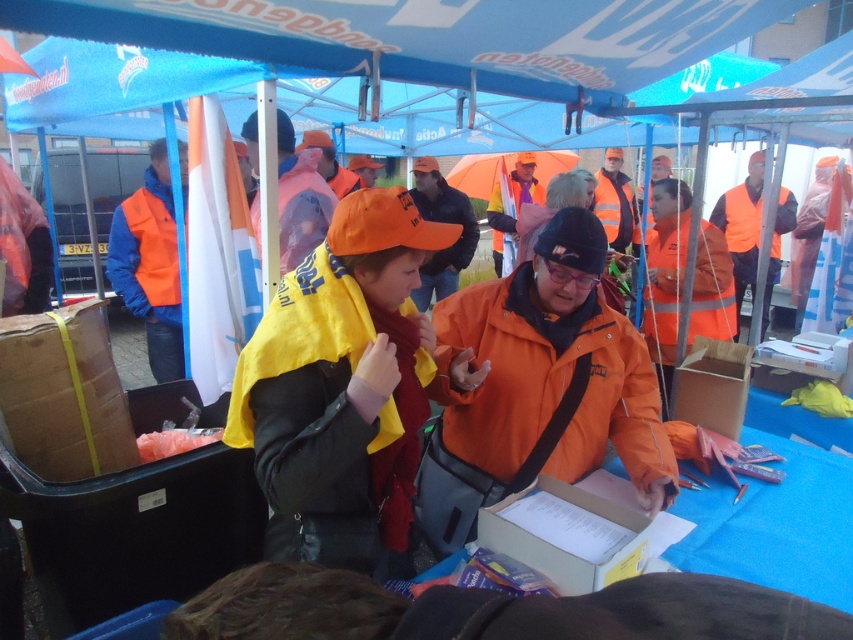
Can you confirm if orange reflective jacket at center is positioned below orange fabric cap at center?

Correct, orange reflective jacket at center is located below orange fabric cap at center.

How much distance is there between orange reflective jacket at center and orange fabric cap at center?

orange reflective jacket at center is 7.15 feet from orange fabric cap at center.

Does point (306, 211) lie in front of point (471, 220)?

Yes, it is in front of point (471, 220).

Identify the location of orange reflective jacket at center. The image size is (853, 640). (299, 198).

Who is shorter, orange matte jacket at center or cardboard box at center?

Standing shorter between the two is cardboard box at center.

Is orange matte jacket at center above cardboard box at center?

Yes, orange matte jacket at center is above cardboard box at center.

Is point (642, 342) farther from camera compared to point (550, 490)?

Yes, it is behind point (550, 490).

Identify the location of orange matte jacket at center. The width and height of the screenshot is (853, 640). (546, 384).

Which is in front, point (496, 342) or point (361, 236)?

Point (361, 236) is in front.

Between point (637, 483) and point (254, 333), which one is positioned in front?

Point (254, 333)

The height and width of the screenshot is (640, 853). Find the location of `orange matte jacket at center`. orange matte jacket at center is located at coordinates (546, 384).